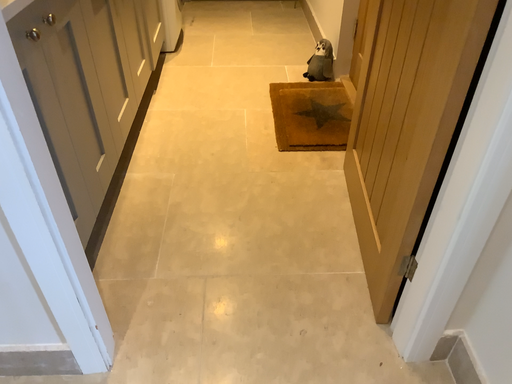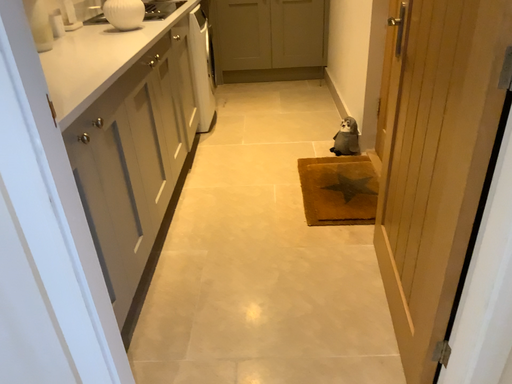
Question: Which way did the camera rotate in the video?

Choices:
 (A) rotated downward
 (B) rotated upward

Answer: (B)